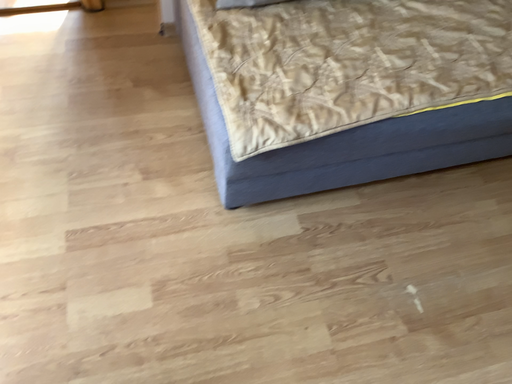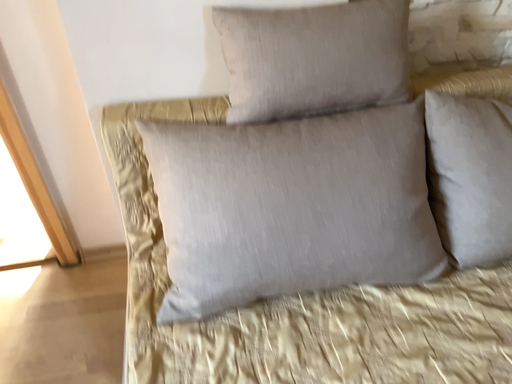
Question: How did the camera likely rotate when shooting the video?

Choices:
 (A) rotated left
 (B) rotated right

Answer: (A)